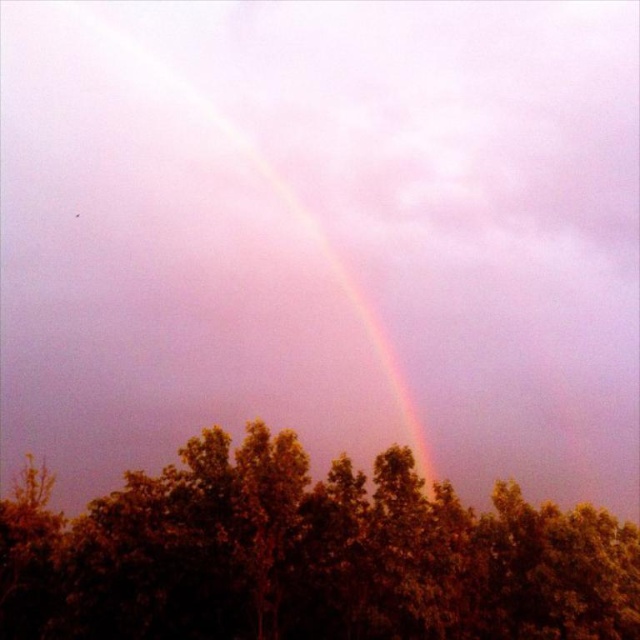
You are an artist trying to paint the scene. You want to ensure the green leafy tree at center is proportionally smaller than the rainbow at upper center. Does the current arrangement allow this?

Yes, the green leafy tree at center is shorter than the rainbow at upper center, so the current arrangement allows the tree to be proportionally smaller than the rainbow.

You are standing in the forest looking up at the rainbow. There are two points in the sky marked as point [186,497] and point [387,352]. Which point is closer to you?

Point [186,497] is closer to the camera than point [387,352], so the point closer to you is point [186,497].